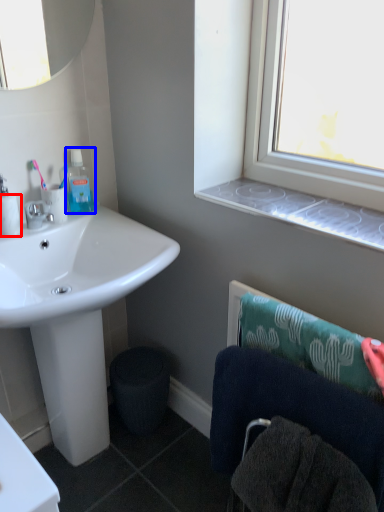
Question: Among these objects, which one is farthest to the camera, toilet paper (highlighted by a red box) or mouthwash (highlighted by a blue box)?

Choices:
 (A) toilet paper
 (B) mouthwash

Answer: (B)